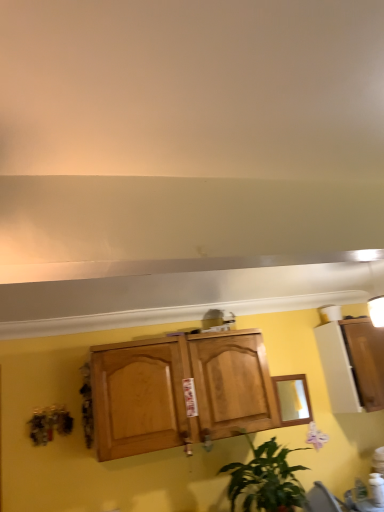
Question: Can you confirm if wooden mirror at center is smaller than green leafy plant at lower center?

Choices:
 (A) no
 (B) yes

Answer: (B)

Question: Is wooden mirror at center with green leafy plant at lower center?

Choices:
 (A) no
 (B) yes

Answer: (A)

Question: Is wooden mirror at center at the right side of green leafy plant at lower center?

Choices:
 (A) no
 (B) yes

Answer: (B)

Question: Would you say wooden mirror at center is outside green leafy plant at lower center?

Choices:
 (A) no
 (B) yes

Answer: (B)

Question: Is green leafy plant at lower center surrounded by wooden mirror at center?

Choices:
 (A) yes
 (B) no

Answer: (B)

Question: Do you think matte brown chair at lower right is within matte purple flower at lower right, or outside of it?

Choices:
 (A) inside
 (B) outside

Answer: (B)

Question: Based on their sizes in the image, would you say matte brown chair at lower right is bigger or smaller than matte purple flower at lower right?

Choices:
 (A) small
 (B) big

Answer: (B)

Question: In the image, is matte brown chair at lower right positioned in front of or behind matte purple flower at lower right?

Choices:
 (A) front
 (B) behind

Answer: (A)

Question: From the image's perspective, is matte brown chair at lower right positioned above or below matte purple flower at lower right?

Choices:
 (A) below
 (B) above

Answer: (A)

Question: Is matte purple flower at lower right taller or shorter than white glossy cabinet at right?

Choices:
 (A) short
 (B) tall

Answer: (A)

Question: From the image's perspective, relative to white glossy cabinet at right, is matte purple flower at lower right above or below?

Choices:
 (A) above
 (B) below

Answer: (B)

Question: Based on their positions, is matte purple flower at lower right located to the left or right of white glossy cabinet at right?

Choices:
 (A) left
 (B) right

Answer: (A)

Question: Relative to white glossy cabinet at right, is matte purple flower at lower right in front or behind?

Choices:
 (A) behind
 (B) front

Answer: (A)

Question: In the image, is green leafy plant at lower center on the left side or the right side of matte purple flower at lower right?

Choices:
 (A) left
 (B) right

Answer: (A)

Question: Is green leafy plant at lower center spatially inside matte purple flower at lower right, or outside of it?

Choices:
 (A) inside
 (B) outside

Answer: (B)